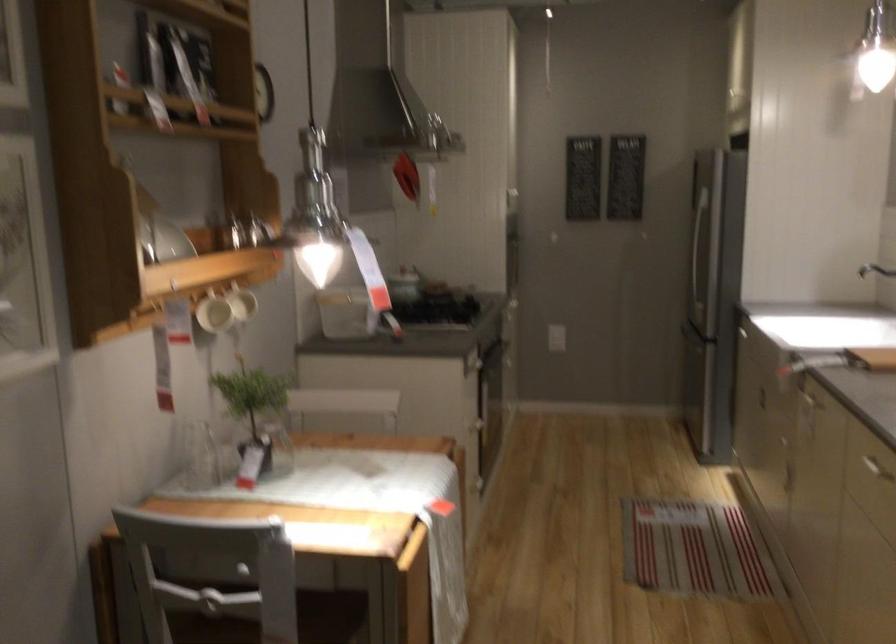
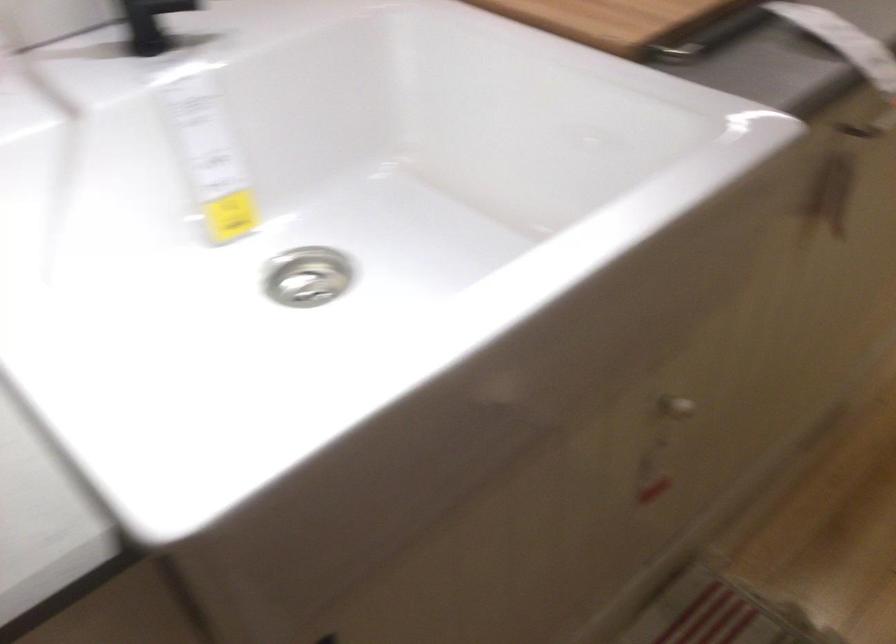
In the second image, find the point that corresponds to point (810, 442) in the first image.

(675, 408)